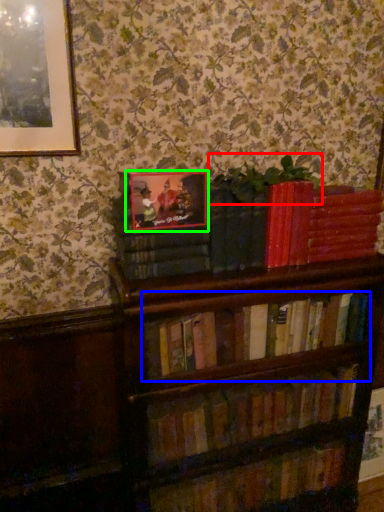
Question: Which object is the farthest from plant (highlighted by a red box)? Choose among these: book (highlighted by a blue box) or picture frame (highlighted by a green box).

Choices:
 (A) book
 (B) picture frame

Answer: (A)